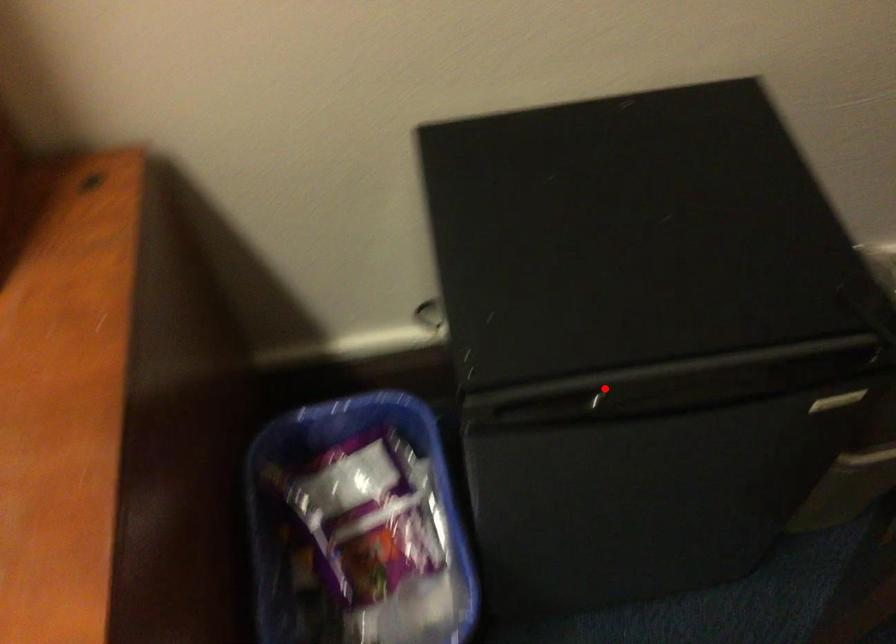
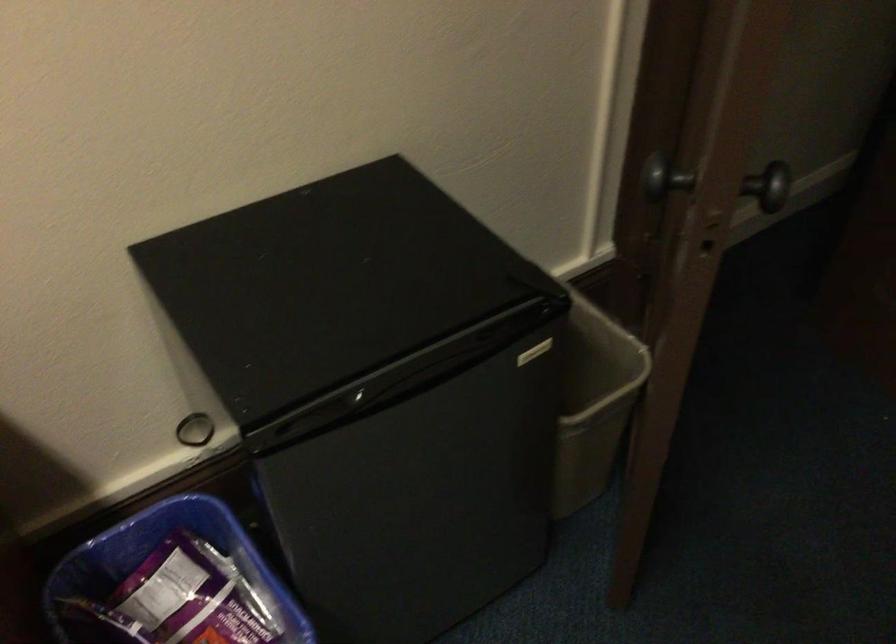
The point at the highlighted location is marked in the first image. Where is the corresponding point in the second image?

(365, 399)